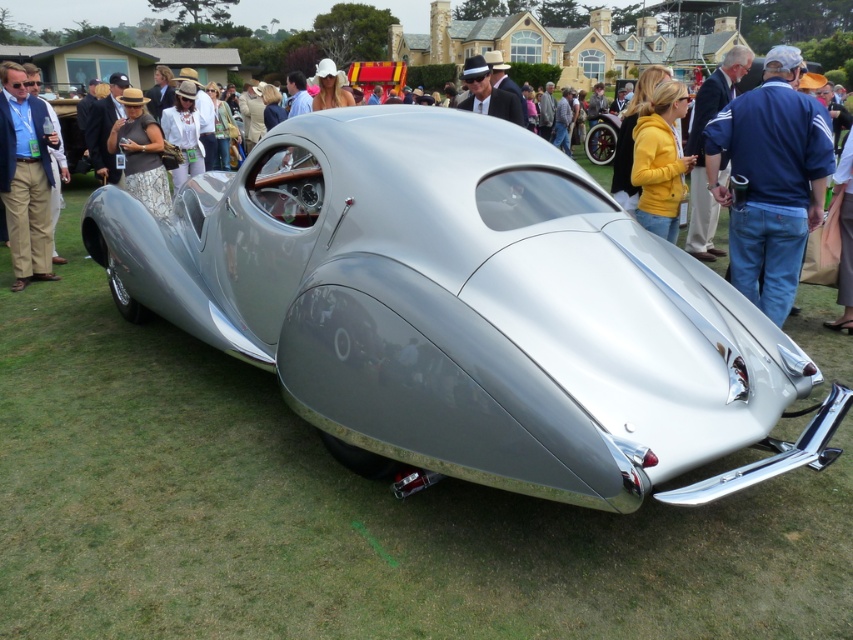
Based on the photo, does polished silver car at center have a greater width compared to blue denim jeans at right?

Yes, polished silver car at center is wider than blue denim jeans at right.

Which is more to the right, polished silver car at center or blue denim jeans at right?

blue denim jeans at right is more to the right.

Which is behind, point (431, 419) or point (767, 90)?

The point (767, 90) is more distant.

You are a GUI agent. You are given a task and a screenshot of the screen. Output one action in this format:
    pyautogui.click(x=<x>, y=<y>)
    Task: Click on the polished silver car at center
    This screenshot has width=853, height=640.
    Given the screenshot: What is the action you would take?
    pyautogui.click(x=467, y=310)

Is blue denim jeans at right bigger than brushed metal jacket at left?

Actually, blue denim jeans at right might be smaller than brushed metal jacket at left.

Does point (735, 170) come closer to viewer compared to point (44, 141)?

Yes, it is in front of point (44, 141).

Locate an element on the screen. blue denim jeans at right is located at coordinates (770, 179).

Can you confirm if polished silver car at center is positioned to the right of brushed metal jacket at left?

Yes, polished silver car at center is to the right of brushed metal jacket at left.

Who is shorter, polished silver car at center or brushed metal jacket at left?

polished silver car at center is shorter.

Who is more forward, (469, 371) or (36, 108)?

Point (469, 371)

Where is `polished silver car at center`? The width and height of the screenshot is (853, 640). polished silver car at center is located at coordinates (467, 310).